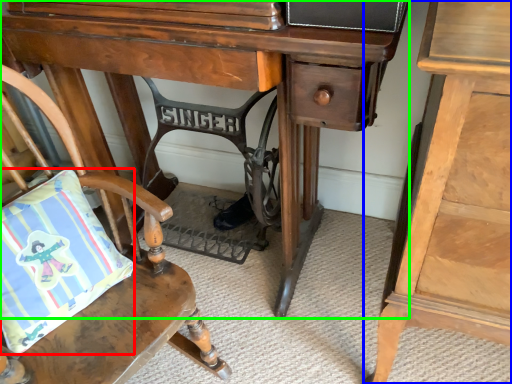
Question: Estimate the real-world distances between objects in this image. Which object is farther from pillow (highlighted by a red box), nightstand (highlighted by a blue box) or desk (highlighted by a green box)?

Choices:
 (A) nightstand
 (B) desk

Answer: (A)